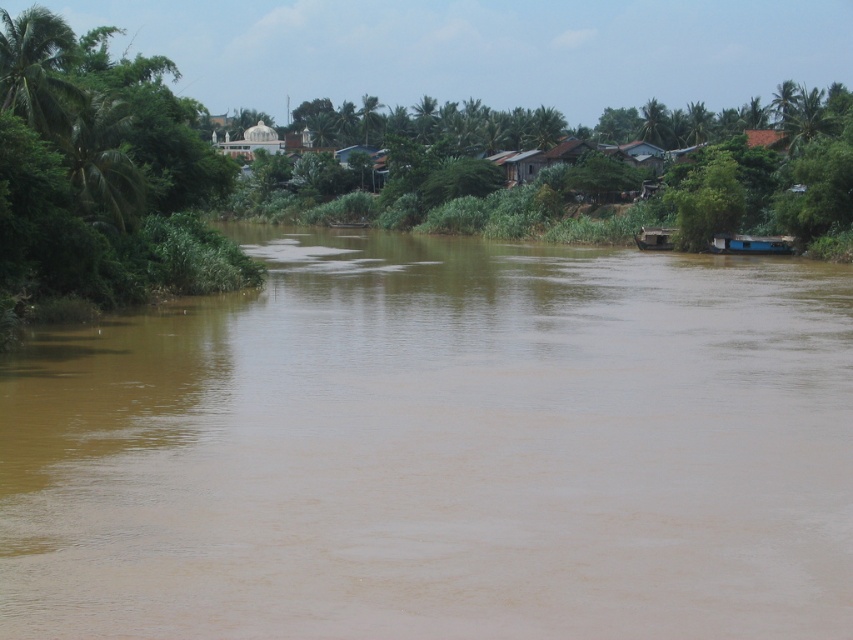
Question: Which object appears farthest from the camera in this image?

Choices:
 (A) brown wooden boat at right
 (B) brown muddy water at center
 (C) green leafy tree at left
 (D) blue matte houseboat at right

Answer: (A)

Question: Which point appears farthest from the camera in this image?

Choices:
 (A) (642, 250)
 (B) (830, 513)
 (C) (714, 244)
 (D) (161, 140)

Answer: (A)

Question: Does brown muddy water at center appear under green leafy tree at left?

Choices:
 (A) yes
 (B) no

Answer: (A)

Question: Does green leafy tree at left appear on the left side of blue matte houseboat at right?

Choices:
 (A) no
 (B) yes

Answer: (B)

Question: Which point appears closest to the camera in this image?

Choices:
 (A) (218, 429)
 (B) (670, 246)

Answer: (A)

Question: Is the position of brown muddy water at center less distant than that of blue matte houseboat at right?

Choices:
 (A) no
 (B) yes

Answer: (B)